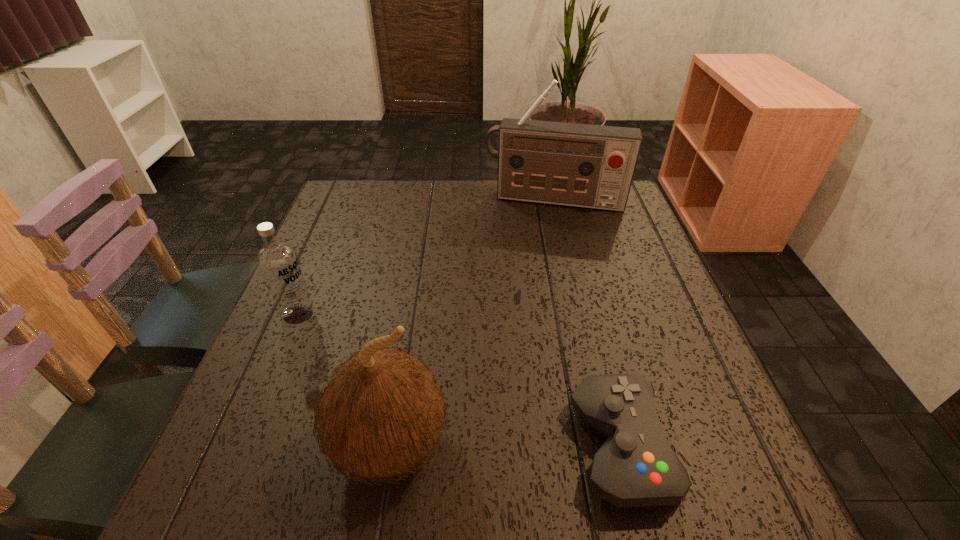
Where is `vacant point that satisfies the following two spatial constraints: 1. on the surface of the coconut; 2. on the left side of the control`? vacant point that satisfies the following two spatial constraints: 1. on the surface of the coconut; 2. on the left side of the control is located at coordinates (390, 447).